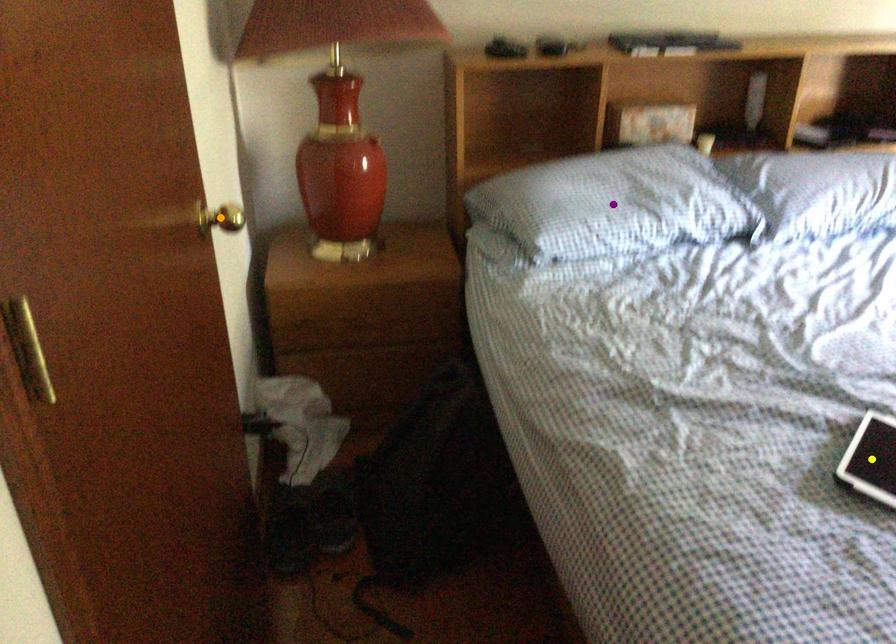
Order these from nearest to farthest:
yellow point, orange point, purple point

orange point
purple point
yellow point